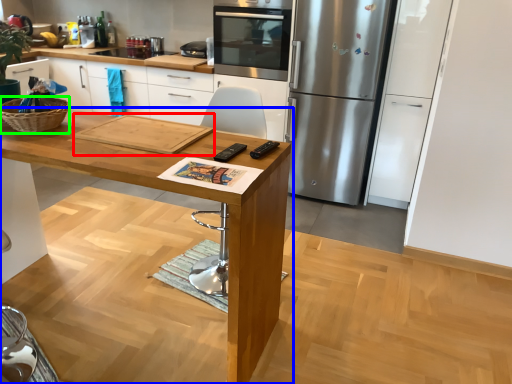
Question: Based on their relative distances, which object is farther from cutting board (highlighted by a red box)? Choose from table (highlighted by a blue box) and basket (highlighted by a green box).

Choices:
 (A) table
 (B) basket

Answer: (B)